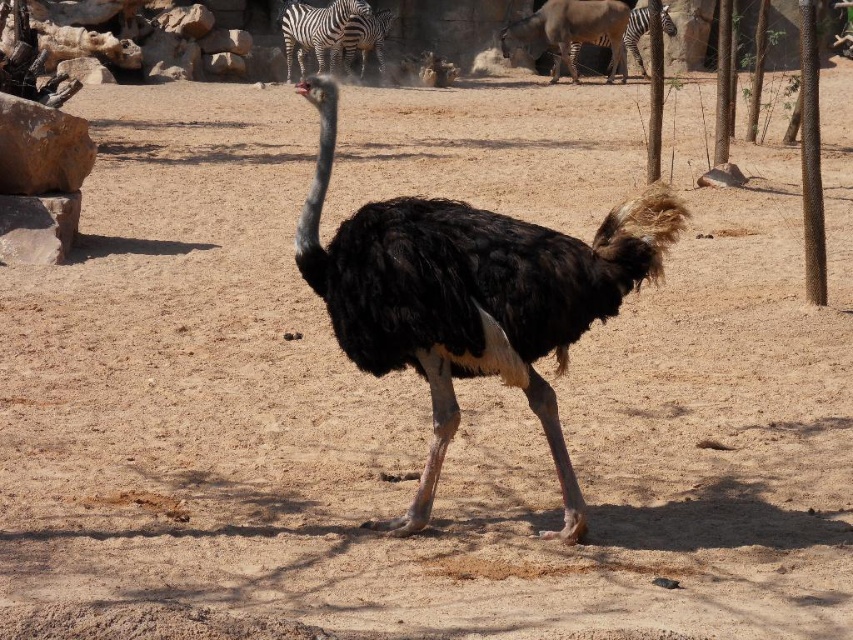
In the scene shown: You are a zookeeper standing at the edge of the enclosure. You need to toss a small treat to the black feathered ostrich at center. The treat can travel 15 feet. Will the treat reach the ostrich?

The black feathered ostrich at center is 15.30 feet away from the viewer. Since the treat can only travel 15 feet, it will not reach the ostrich.

You are standing in front of the zoo enclosure and notice two points marked in the image. The first point is at coordinate point (x=730, y=116) and the second is at point (x=357, y=22). Which point is nearer to you?

Point (x=730, y=116) is closer to the viewer than point (x=357, y=22).